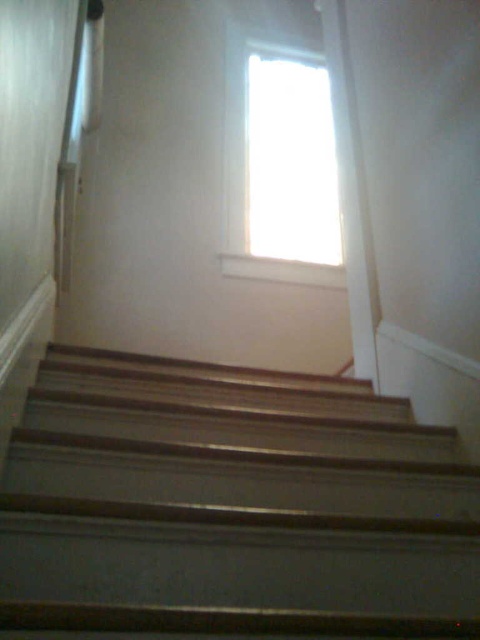
Question: Is wooden stairs at center bigger than transparent glass window at upper center?

Choices:
 (A) no
 (B) yes

Answer: (A)

Question: Which object appears closest to the camera in this image?

Choices:
 (A) wooden stairs at center
 (B) transparent glass window at upper center

Answer: (A)

Question: Which point appears closest to the camera in this image?

Choices:
 (A) (284, 154)
 (B) (59, 413)

Answer: (B)

Question: Can you confirm if wooden stairs at center is smaller than transparent glass window at upper center?

Choices:
 (A) no
 (B) yes

Answer: (B)

Question: Can you confirm if wooden stairs at center is positioned to the right of transparent glass window at upper center?

Choices:
 (A) yes
 (B) no

Answer: (B)

Question: Which of the following is the farthest from the observer?

Choices:
 (A) transparent glass window at upper center
 (B) wooden stairs at center

Answer: (A)